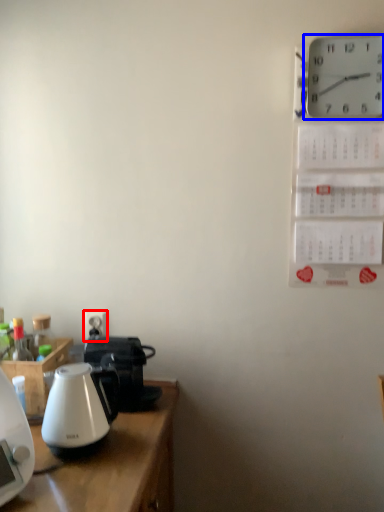
Question: Among these objects, which one is farthest to the camera, electric outlet (highlighted by a red box) or wall clock (highlighted by a blue box)?

Choices:
 (A) electric outlet
 (B) wall clock

Answer: (A)